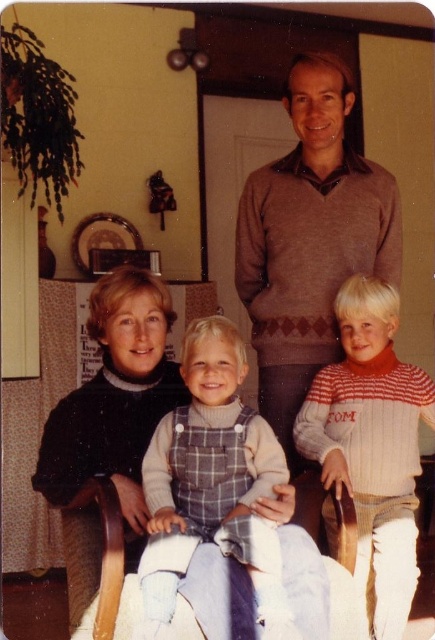
You are a photographer trying to focus on the children in the family portrait. Which child is closer to you, the one wearing the brown sweater at center or the one in plaid denim overalls at center?

The brown sweater at center is closer to you than the plaid denim overalls at center.

You are standing in the living room where the family portrait was taken. You want to place a small decorative item exactly at the point marked as point (395, 262) in the image. If you are currently standing 10 feet away from the wall where the portrait is hanging, can you reach the point without moving closer?

The distance between point (395, 262) and the viewer is 8.02 feet. Since you are currently 10 feet away from the wall, you are farther than the required distance. Therefore, you can reach the point without moving closer.